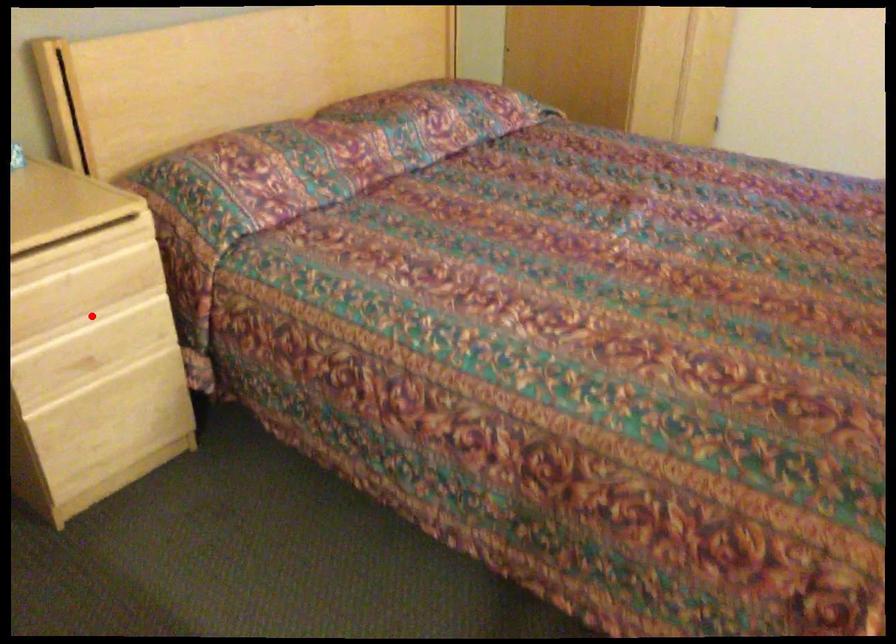
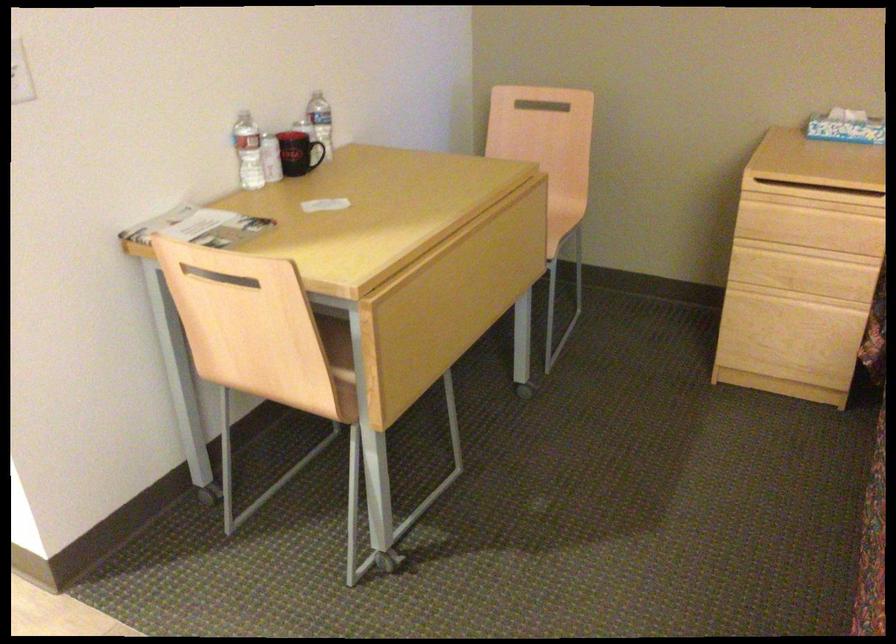
Locate, in the second image, the point that corresponds to the highlighted location in the first image.

(810, 251)